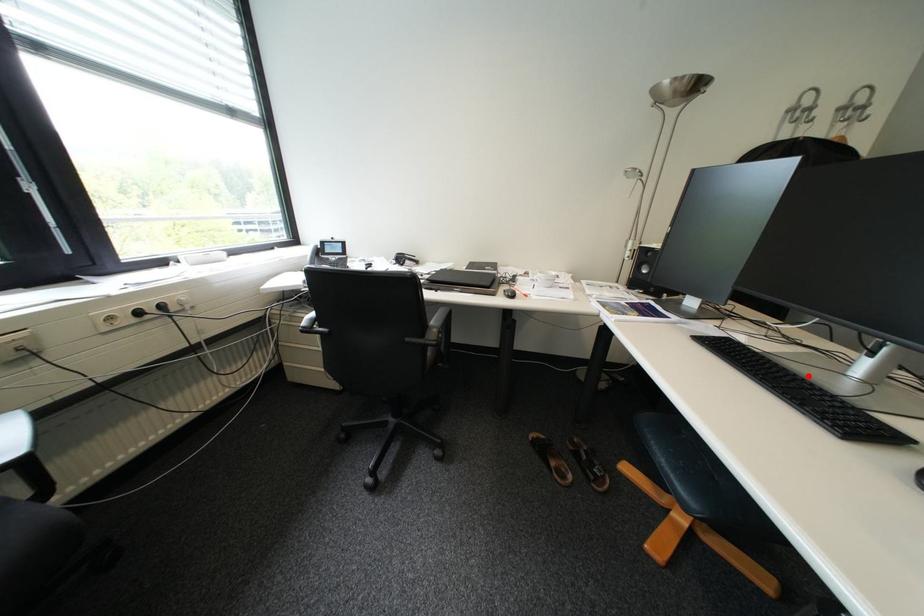
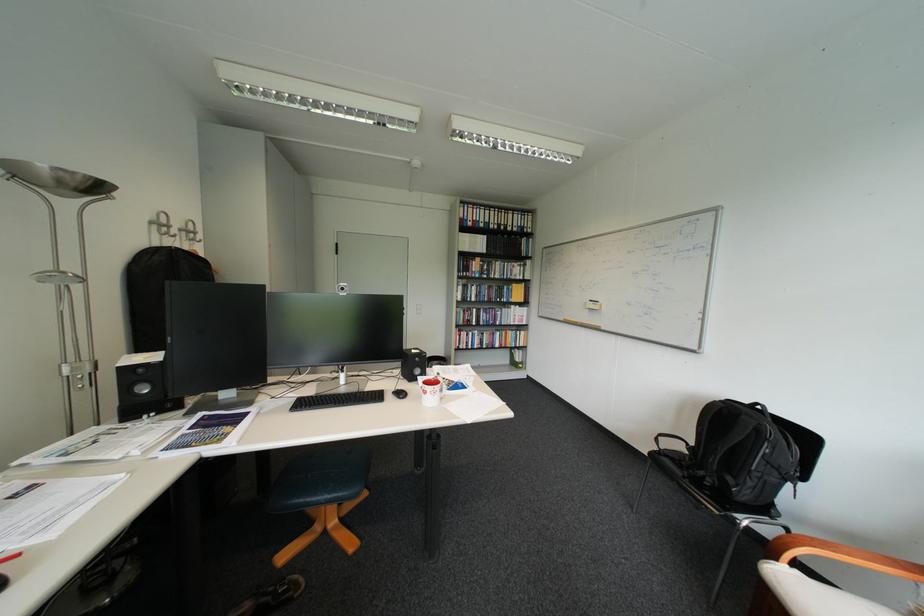
The point at the highlighted location is marked in the first image. Where is the corresponding point in the second image?

(357, 394)